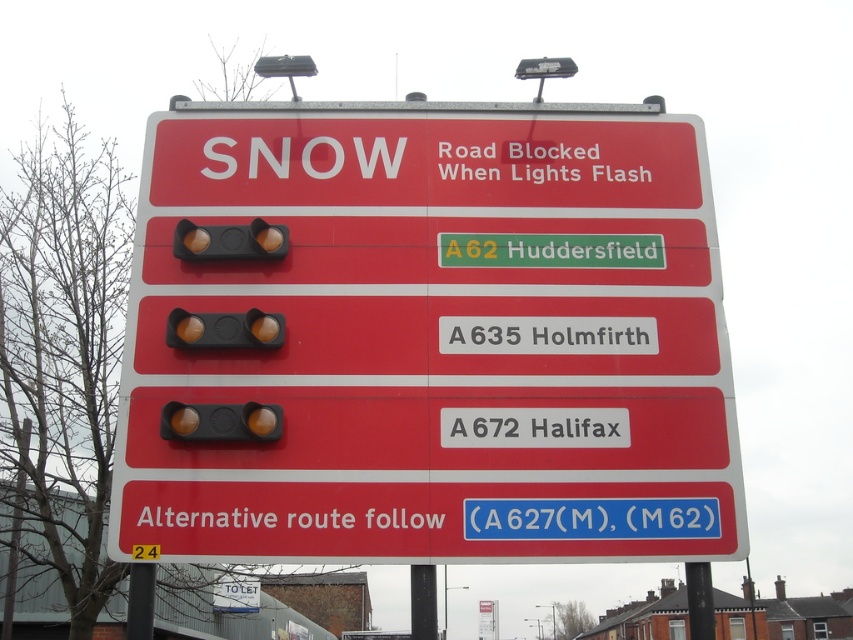
You are a driver approaching the road sign and need to determine the spatial relationship between the red plastic sign at center and the matte yellow traffic light at upper center. Which object is wider?

The red plastic sign at center is wider than the matte yellow traffic light at upper center according to the description.

You are a driver approaching the road sign and see the matte black traffic light at center and the matte yellow traffic light at upper center. Which traffic light is closer to you?

The matte black traffic light at center is closer to you because it is in front of the matte yellow traffic light at upper center.

You are a driver approaching the road sign and notice the matte black traffic light at center. Based on the sign, what does it mean when the lights start flashing?

When the matte black traffic light at center starts flashing, it indicates that the road ahead is blocked, as per the sign which states,